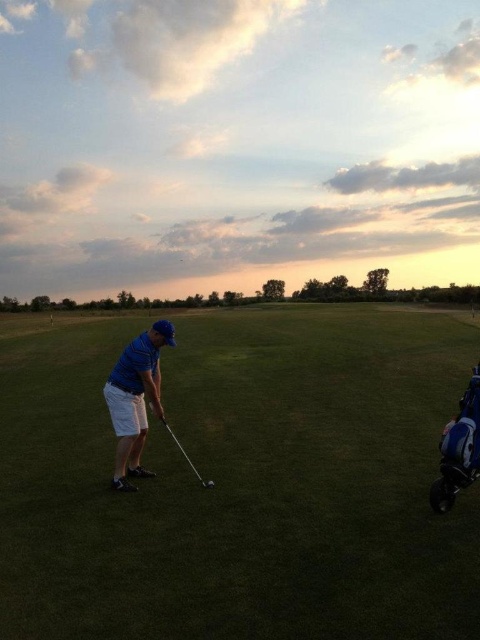
Question: Which of the following is the farthest from the observer?

Choices:
 (A) shiny silver golf ball at center
 (B) green grass at center
 (C) shiny metallic golf club at center

Answer: (C)

Question: Does green grass at center come in front of shiny metallic golf club at center?

Choices:
 (A) no
 (B) yes

Answer: (B)

Question: Is the position of green grass at center more distant than that of blue cotton shirt at center?

Choices:
 (A) yes
 (B) no

Answer: (B)

Question: Which point is farther to the camera?

Choices:
 (A) shiny silver golf ball at center
 (B) blue cotton shirt at center
 (C) shiny metallic golf club at center
 (D) green grass at center

Answer: (C)

Question: Can you confirm if green grass at center is positioned to the left of blue cotton shirt at center?

Choices:
 (A) yes
 (B) no

Answer: (B)

Question: Which point appears closest to the camera in this image?

Choices:
 (A) (211, 486)
 (B) (407, 412)
 (C) (168, 323)

Answer: (A)